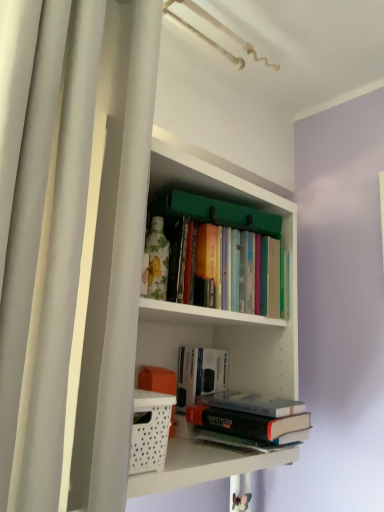
Question: Considering the positions of hardcover books at center, the third book from the bottom, and white matte bookshelf at center in the image, is hardcover books at center, the third book from the bottom, wider or thinner than white matte bookshelf at center?

Choices:
 (A) wide
 (B) thin

Answer: (B)

Question: Considering their positions, is hardcover books at center, the 1th book viewed from the top, located in front of or behind white matte bookshelf at center?

Choices:
 (A) behind
 (B) front

Answer: (A)

Question: Which object is the closest to the hardcover books at center, the 1th book viewed from the top?

Choices:
 (A) white matte shower curtain at left
 (B) white perforated basket at lower left
 (C) hardcover book at center, the first book ordered from the bottom
 (D) white matte bookshelf at center
 (E) hardcover book at center, the 2th book positioned from the bottom

Answer: (D)

Question: Considering the real-world distances, which object is closest to the hardcover book at center, the first book ordered from the bottom?

Choices:
 (A) white perforated basket at lower left
 (B) white matte bookshelf at center
 (C) white matte shower curtain at left
 (D) hardcover books at center, the 1th book viewed from the top
 (E) hardcover book at center, the 2th book positioned from the bottom

Answer: (E)